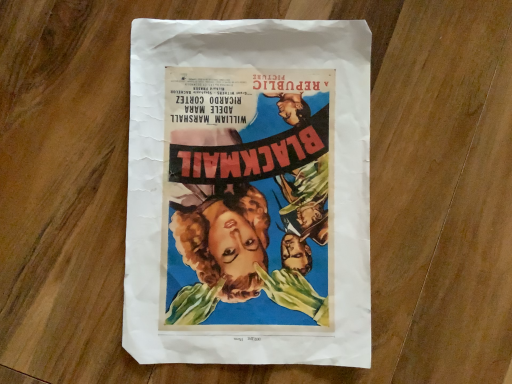
Where is `matte paper poster at center`? The width and height of the screenshot is (512, 384). matte paper poster at center is located at coordinates (248, 193).

Image resolution: width=512 pixels, height=384 pixels. Describe the element at coordinates (248, 193) in the screenshot. I see `matte paper poster at center` at that location.

Locate an element on the screen. This screenshot has height=384, width=512. matte paper poster at center is located at coordinates (248, 193).